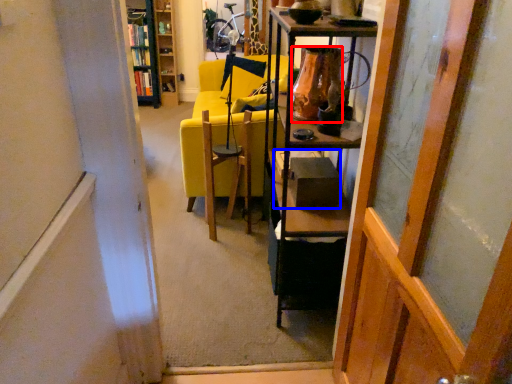
Question: Which of the following is the farthest to the observer, vase (highlighted by a red box) or box (highlighted by a blue box)?

Choices:
 (A) vase
 (B) box

Answer: (B)